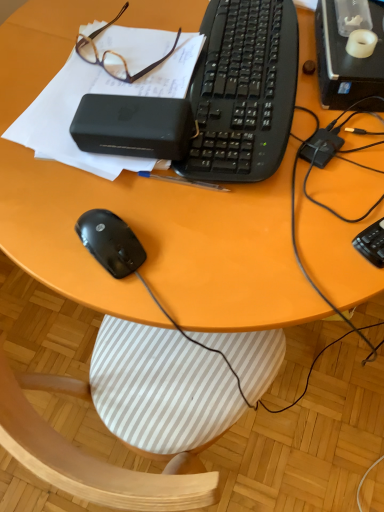
Where is `vacant area situated to the left side of black plastic power bank at upper center`? This screenshot has height=512, width=384. vacant area situated to the left side of black plastic power bank at upper center is located at coordinates (36, 167).